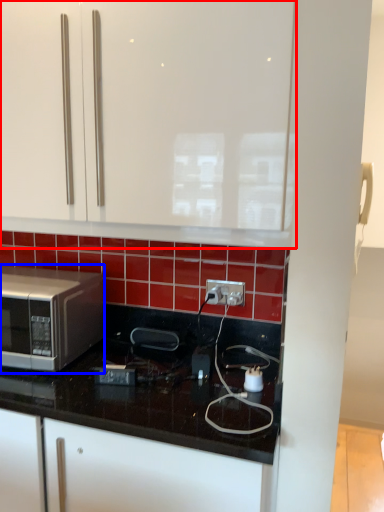
Question: Which point is further to the camera, cabinetry (highlighted by a red box) or microwave oven (highlighted by a blue box)?

Choices:
 (A) cabinetry
 (B) microwave oven

Answer: (B)